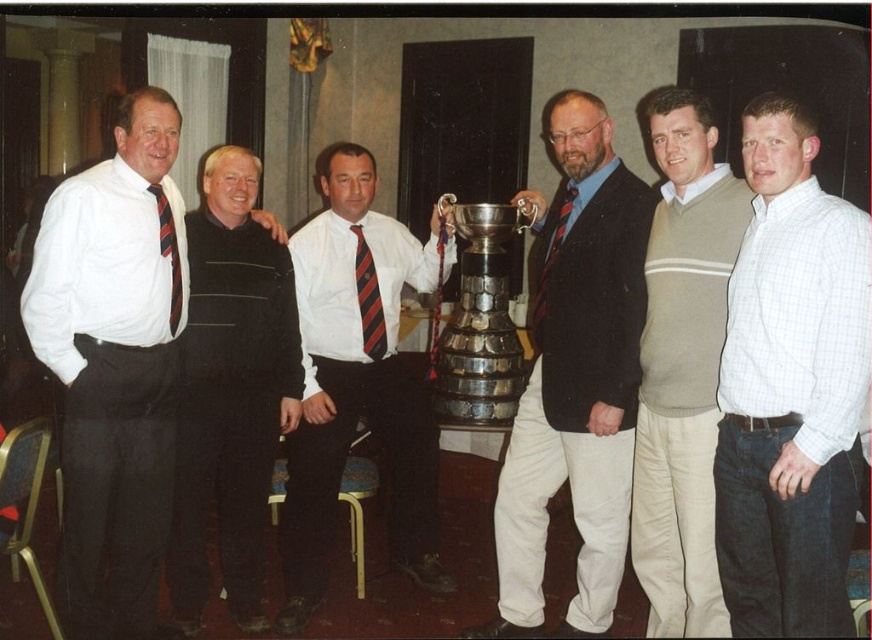
Question: Is shiny silver trophy at center thinner than white shirt with striped tie at center?

Choices:
 (A) yes
 (B) no

Answer: (A)

Question: Which point appears farthest from the camera in this image?

Choices:
 (A) (373, 339)
 (B) (559, 234)
 (C) (172, 282)
 (D) (796, 320)

Answer: (A)

Question: Does red striped tie at center have a larger size compared to striped fabric tie at left?

Choices:
 (A) no
 (B) yes

Answer: (B)

Question: Which object appears farthest from the camera in this image?

Choices:
 (A) silver metallic stanley cup at center
 (B) striped fabric tie at left

Answer: (A)

Question: Is white shirt at left bigger than light brown sweater at center?

Choices:
 (A) yes
 (B) no

Answer: (A)

Question: Which of the following is the closest to the observer?

Choices:
 (A) white shirt with striped tie at center
 (B) white checkered shirt at center
 (C) striped fabric tie at center
 (D) silver metallic stanley cup at center

Answer: (B)